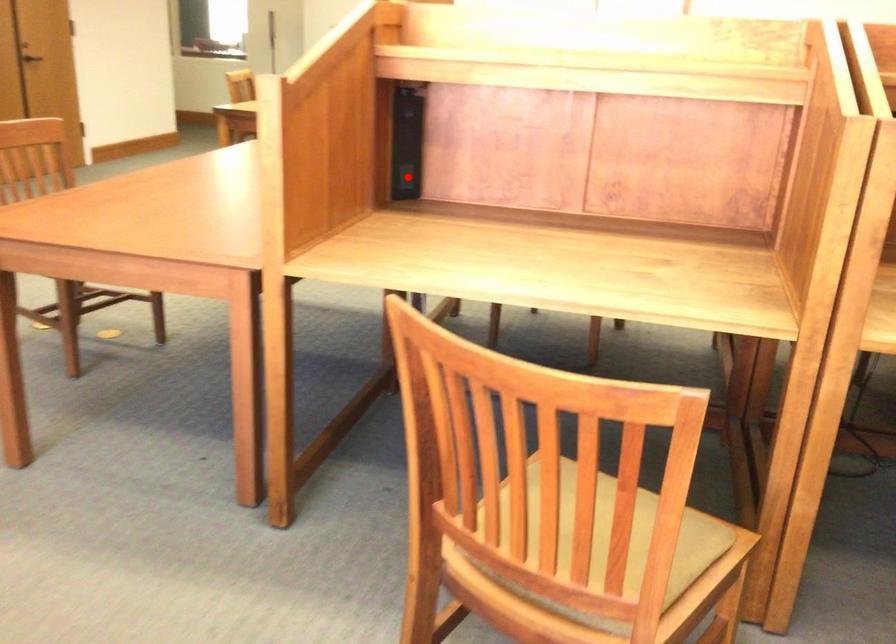
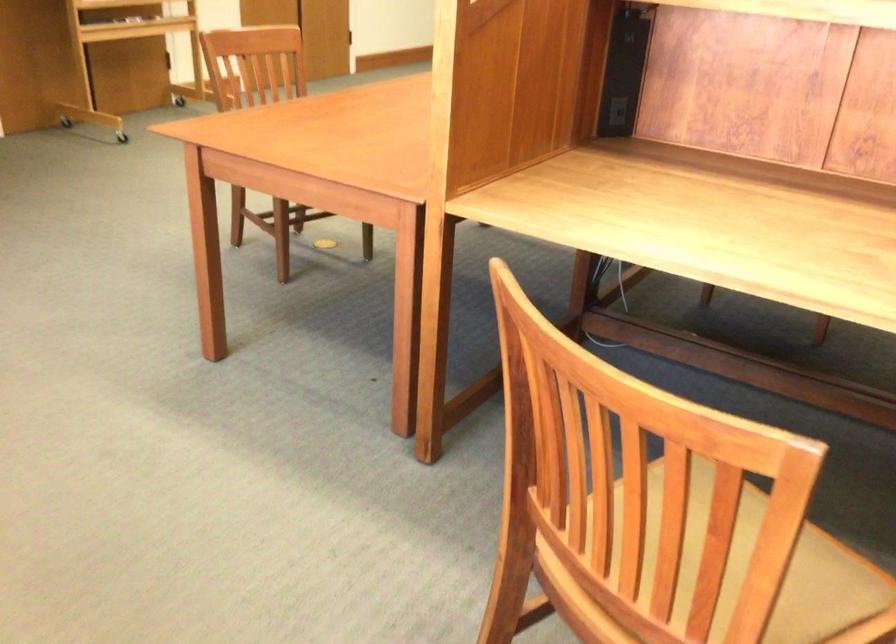
Locate, in the second image, the point that corresponds to the highlighted location in the first image.

(616, 111)